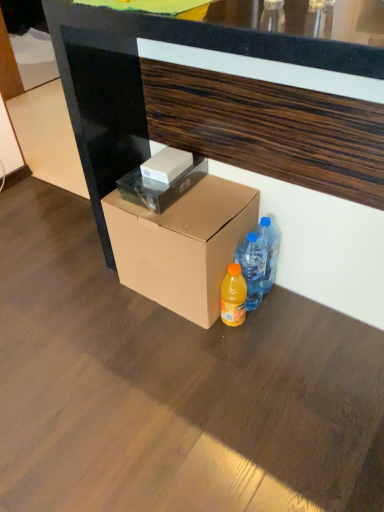
Question: Is brown cardboard box at lower center, the first box ordered from the bottom, in front of translucent plastic bottle at lower right, the second bottle in the right-to-left sequence?

Choices:
 (A) yes
 (B) no

Answer: (A)

Question: Is brown cardboard box at lower center, the 3th box from the top, positioned beyond the bounds of translucent plastic bottle at lower right, which is the 1th bottle from left to right?

Choices:
 (A) yes
 (B) no

Answer: (A)

Question: Does brown cardboard box at lower center, the first box ordered from the bottom, have a greater width compared to translucent plastic bottle at lower right, the second bottle in the right-to-left sequence?

Choices:
 (A) yes
 (B) no

Answer: (A)

Question: Does brown cardboard box at lower center, the 3th box from the top, appear on the right side of translucent plastic bottle at lower right, which is the 1th bottle from left to right?

Choices:
 (A) yes
 (B) no

Answer: (B)

Question: Does brown cardboard box at lower center, the 3th box from the top, touch translucent plastic bottle at lower right, which is the 1th bottle from left to right?

Choices:
 (A) no
 (B) yes

Answer: (A)

Question: In the image, is white matte box at center, acting as the first box starting from the top, on the left side or the right side of translucent plastic bottle at lower right, which is the 1th bottle from left to right?

Choices:
 (A) left
 (B) right

Answer: (A)

Question: Considering the positions of point (153, 173) and point (249, 296), is point (153, 173) closer or farther from the camera than point (249, 296)?

Choices:
 (A) closer
 (B) farther

Answer: (A)

Question: Considering their positions, is white matte box at center, acting as the first box starting from the top, located in front of or behind translucent plastic bottle at lower right, which is the 1th bottle from left to right?

Choices:
 (A) behind
 (B) front

Answer: (A)

Question: From the image's perspective, is white matte box at center, positioned as the third box in bottom-to-top order, located above or below translucent plastic bottle at lower right, the second bottle in the right-to-left sequence?

Choices:
 (A) below
 (B) above

Answer: (B)

Question: Do you think brown wood desk at center is within translucent plastic bottle at lower right, the second bottle in the right-to-left sequence, or outside of it?

Choices:
 (A) outside
 (B) inside

Answer: (A)

Question: From the image's perspective, is brown wood desk at center positioned above or below translucent plastic bottle at lower right, the second bottle in the right-to-left sequence?

Choices:
 (A) below
 (B) above

Answer: (B)

Question: Considering the positions of brown wood desk at center and translucent plastic bottle at lower right, the second bottle in the right-to-left sequence, in the image, is brown wood desk at center bigger or smaller than translucent plastic bottle at lower right, the second bottle in the right-to-left sequence,?

Choices:
 (A) big
 (B) small

Answer: (A)

Question: Considering the positions of brown wood desk at center and translucent plastic bottle at lower right, the second bottle in the right-to-left sequence, in the image, is brown wood desk at center taller or shorter than translucent plastic bottle at lower right, the second bottle in the right-to-left sequence,?

Choices:
 (A) short
 (B) tall

Answer: (B)

Question: In terms of width, does brown wood desk at center look wider or thinner when compared to blue translucent water bottles at lower right, which is the 1th bottle from right to left?

Choices:
 (A) thin
 (B) wide

Answer: (B)

Question: Would you say brown wood desk at center is inside or outside blue translucent water bottles at lower right, which is the second bottle in left-to-right order?

Choices:
 (A) inside
 (B) outside

Answer: (B)